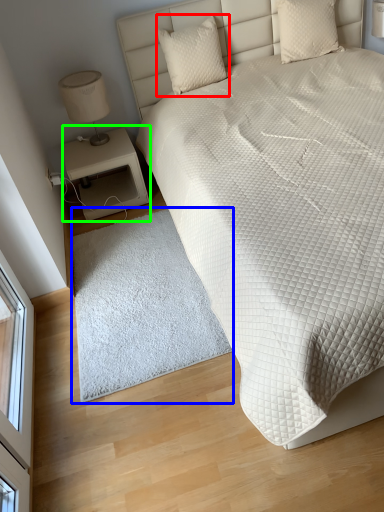
Question: Considering the real-world distances, which object is farthest from pillow (highlighted by a red box)? mat (highlighted by a blue box) or nightstand (highlighted by a green box)?

Choices:
 (A) mat
 (B) nightstand

Answer: (A)